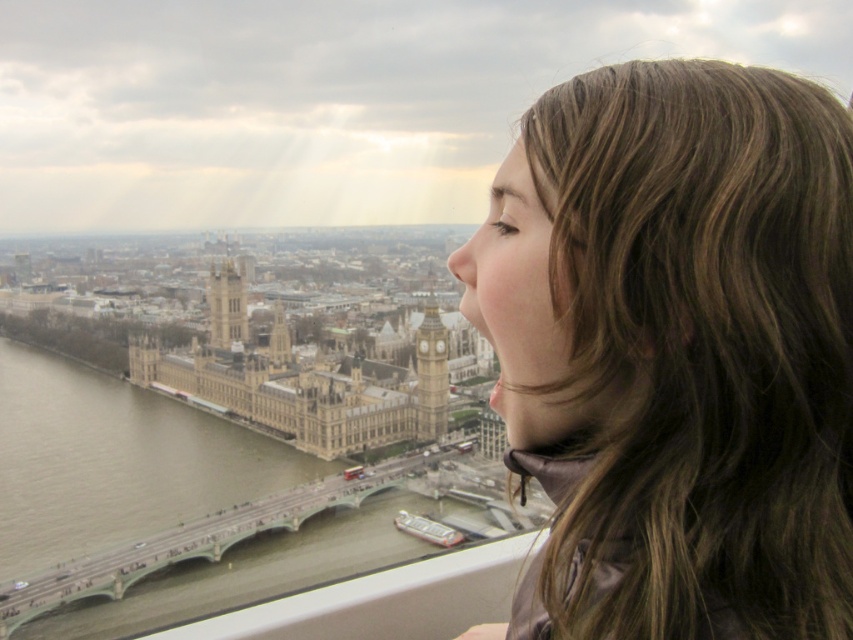
Question: Which point is closer to the camera?

Choices:
 (A) golden stone tower bridge at center
 (B) brown silky hair at upper right

Answer: (B)

Question: Which of the following is the farthest from the observer?

Choices:
 (A) (271, 572)
 (B) (590, 513)
 (C) (418, 408)

Answer: (C)

Question: Which object appears farthest from the camera in this image?

Choices:
 (A) brown water at lower left
 (B) golden stone clock tower at center

Answer: (B)

Question: Is brown silky hair at upper right further to camera compared to concrete bridge at lower left?

Choices:
 (A) no
 (B) yes

Answer: (A)

Question: Can you confirm if golden stone tower bridge at center is positioned to the left of golden stone tower at center?

Choices:
 (A) no
 (B) yes

Answer: (A)

Question: Where is concrete bridge at lower left located in relation to golden stone tower at center in the image?

Choices:
 (A) below
 (B) above

Answer: (A)